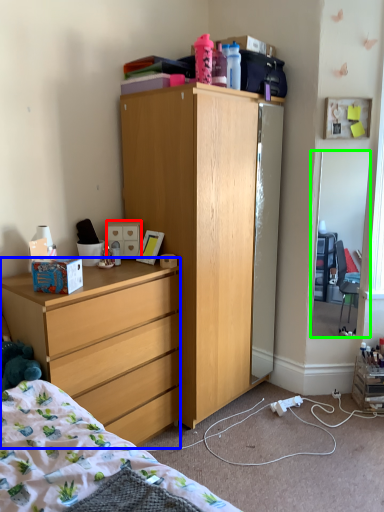
Question: Which object is positioned closest to drawer (highlighted by a red box)? Select from desk (highlighted by a blue box) and mirror (highlighted by a green box).

Choices:
 (A) desk
 (B) mirror

Answer: (A)